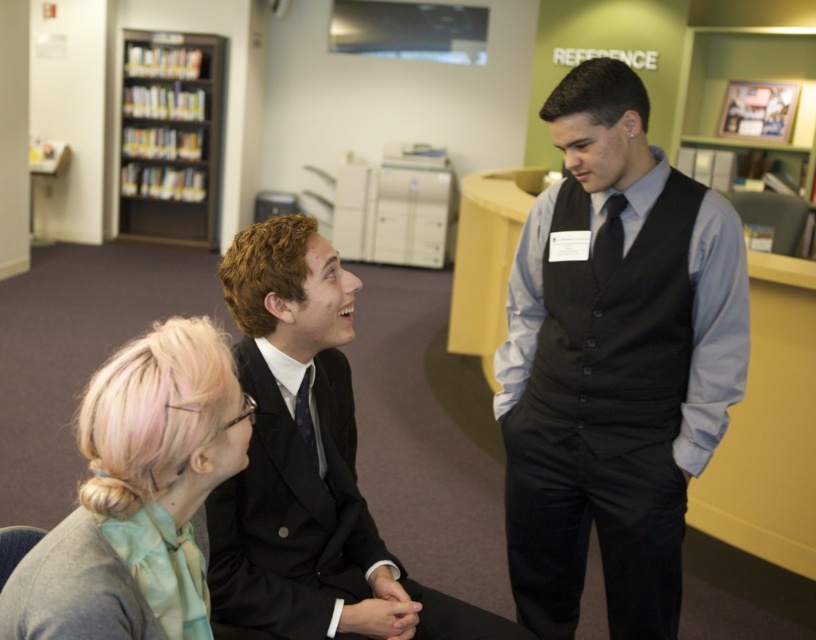
You are taking a photo of the scene and want to focus on both the point at [206,461] and the point at [123,65]. Which point should you adjust your focus to first to ensure both are in sharp view?

You should focus on point [206,461] first because it is closer to the camera. By focusing on the closer point, the farther point [123,65] will also be in focus due to the depth of field.

You are an artist trying to sketch this scene. You notice the matte black vest at center and the blonde hair at left. Which object is covering part of the other?

The matte black vest at center is positioned over the blonde hair at left, so it is covering part of it.